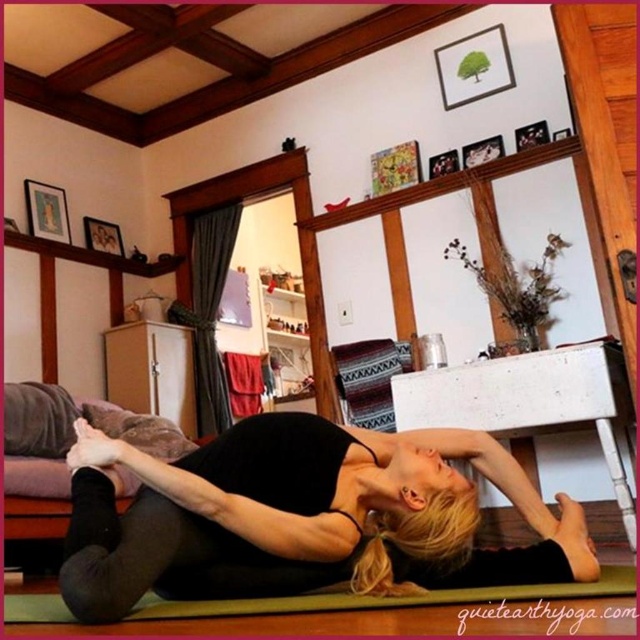
Question: Which object is closer to the camera taking this photo?

Choices:
 (A) black matte yoga mat at center
 (B) green rubber yoga mat at lower center

Answer: (B)

Question: Which point is farther to the camera?

Choices:
 (A) black matte yoga mat at center
 (B) green rubber yoga mat at lower center

Answer: (A)

Question: Considering the relative positions of black matte yoga mat at center and green rubber yoga mat at lower center in the image provided, where is black matte yoga mat at center located with respect to green rubber yoga mat at lower center?

Choices:
 (A) left
 (B) right

Answer: (B)

Question: Does black matte yoga mat at center have a smaller size compared to green rubber yoga mat at lower center?

Choices:
 (A) no
 (B) yes

Answer: (B)

Question: Is the position of black matte yoga mat at center less distant than that of green rubber yoga mat at lower center?

Choices:
 (A) yes
 (B) no

Answer: (B)